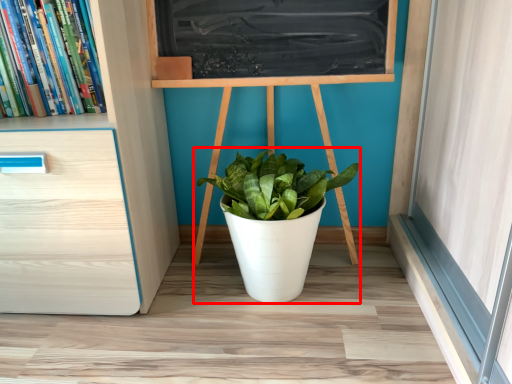
Question: From the image's perspective, considering the relative positions of houseplant (annotated by the red box) and book in the image provided, where is houseplant (annotated by the red box) located with respect to the staircase?

Choices:
 (A) below
 (B) above

Answer: (A)